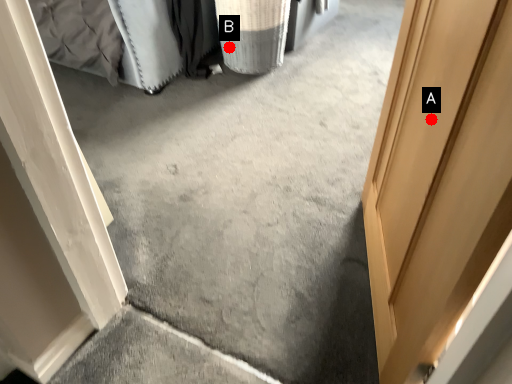
Question: Two points are circled on the image, labeled by A and B beside each circle. Which point appears farthest from the camera in this image?

Choices:
 (A) A is further
 (B) B is further

Answer: (B)